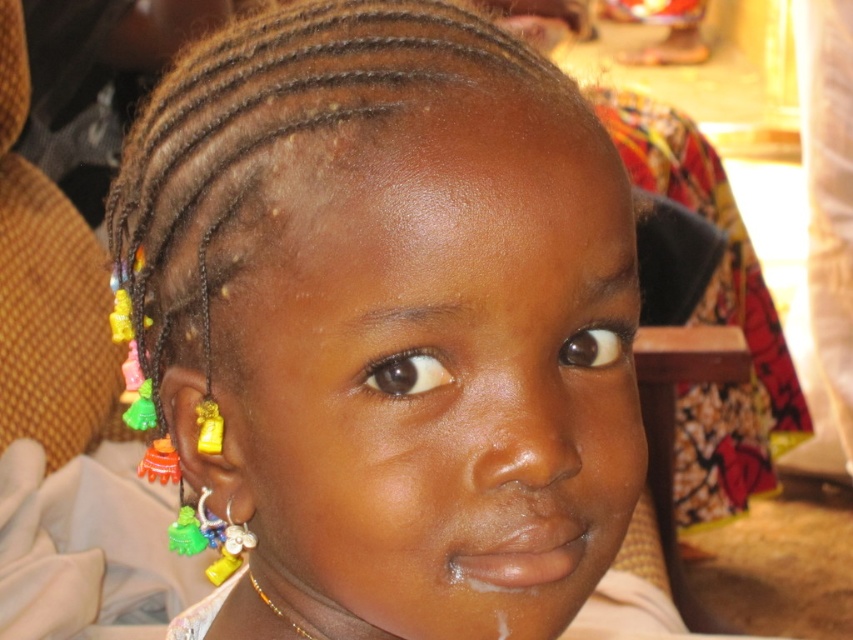
Question: Which object is farther from the camera taking this photo?

Choices:
 (A) multicolored beaded earrings at center
 (B) gold beaded necklace at lower center

Answer: (B)

Question: Which point appears farthest from the camera in this image?

Choices:
 (A) (598, 180)
 (B) (300, 634)

Answer: (B)

Question: Can you confirm if multicolored beaded earrings at center is positioned below gold beaded necklace at lower center?

Choices:
 (A) yes
 (B) no

Answer: (B)

Question: Is multicolored beaded earrings at center bigger than gold beaded necklace at lower center?

Choices:
 (A) yes
 (B) no

Answer: (A)

Question: Does multicolored beaded earrings at center appear on the left side of gold beaded necklace at lower center?

Choices:
 (A) no
 (B) yes

Answer: (A)